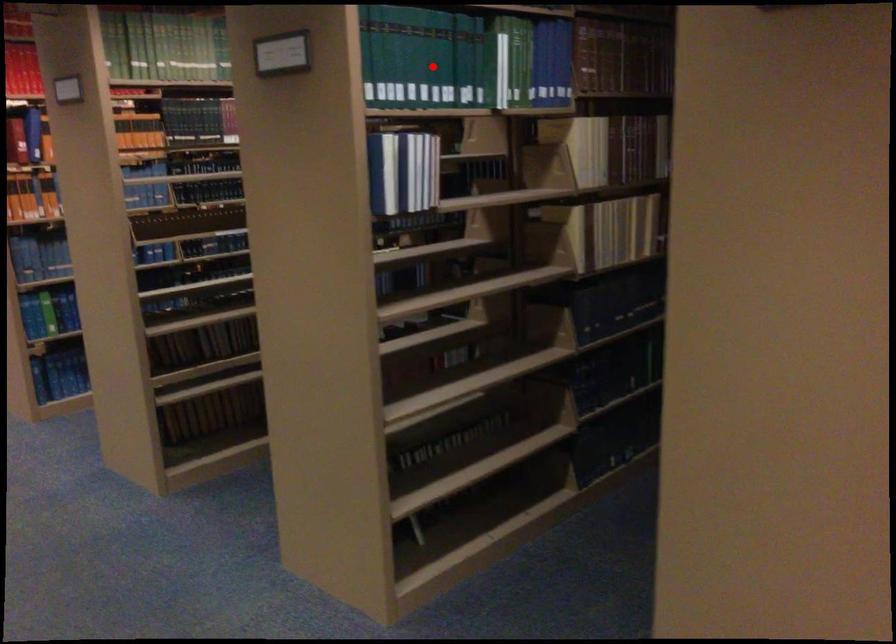
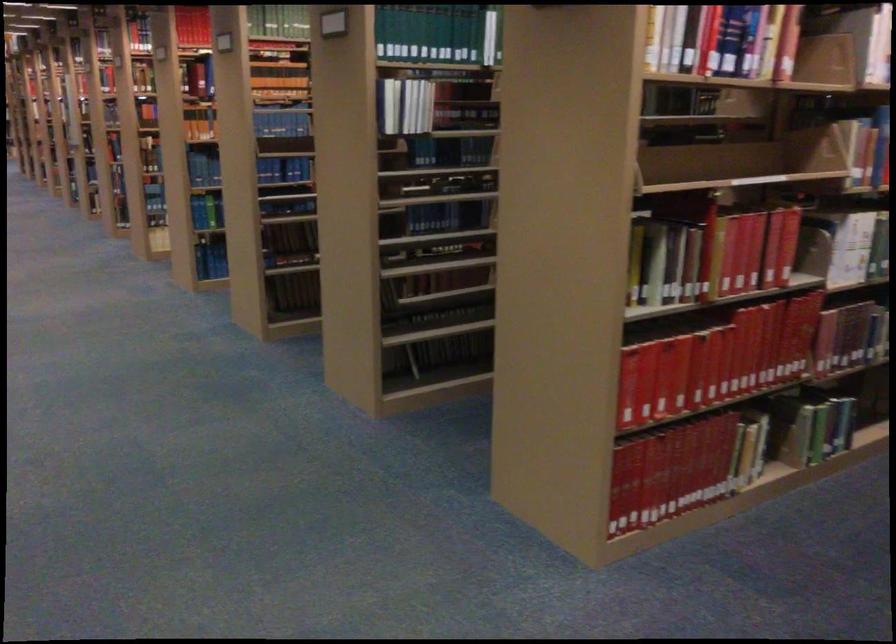
Question: I am providing you with two images of the same scene from different viewpoints. A red point is shown in image1. For the corresponding object point in image2, is it positioned nearer or farther from the camera?

Choices:
 (A) Nearer
 (B) Farther

Answer: (B)